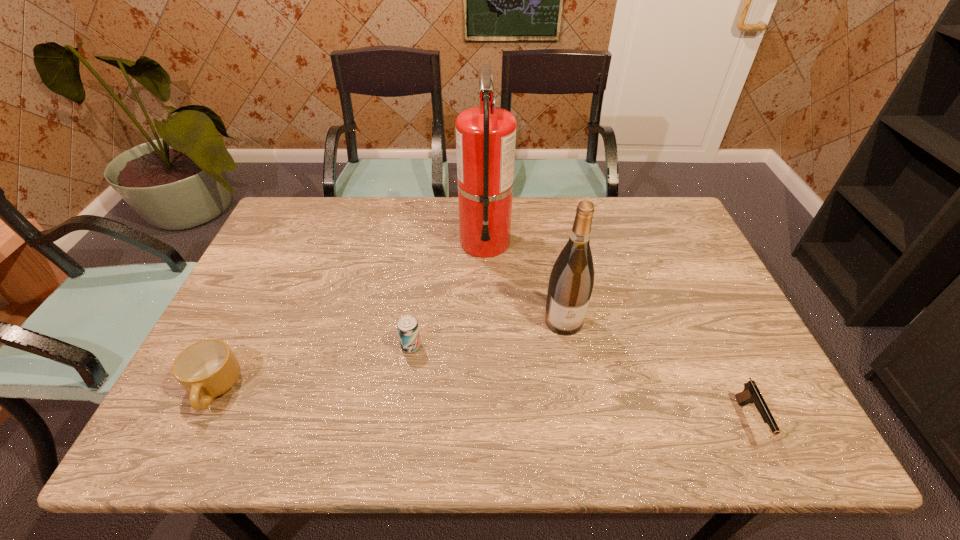
Identify the location of the farthest object. The height and width of the screenshot is (540, 960). (485, 135).

This screenshot has height=540, width=960. Find the location of `the tallest object`. the tallest object is located at coordinates (485, 135).

At what (x,y) coordinates should I click in order to perform the action: click on the second tallest object. Please return your answer as a coordinate pair (x, y). Image resolution: width=960 pixels, height=540 pixels. Looking at the image, I should click on (571, 281).

Find the location of a particular element. The height and width of the screenshot is (540, 960). the fourth nearest object is located at coordinates (571, 281).

Locate an element on the screen. The height and width of the screenshot is (540, 960). beer can is located at coordinates (407, 325).

Find the location of a particular element. This screenshot has width=960, height=540. the fourth object from right to left is located at coordinates (407, 325).

You are a GUI agent. You are given a task and a screenshot of the screen. Output one action in this format:
    pyautogui.click(x=<x>, y=<y>)
    Task: Click on the leftmost object
    This screenshot has width=960, height=540.
    Given the screenshot: What is the action you would take?
    pyautogui.click(x=206, y=369)

Locate an element on the screen. The image size is (960, 540). pistol is located at coordinates (751, 394).

Identify the location of the rightmost object. (751, 394).

Locate an element on the screen. vacant point located 0.390m at the nozzle of the tallest object is located at coordinates (487, 380).